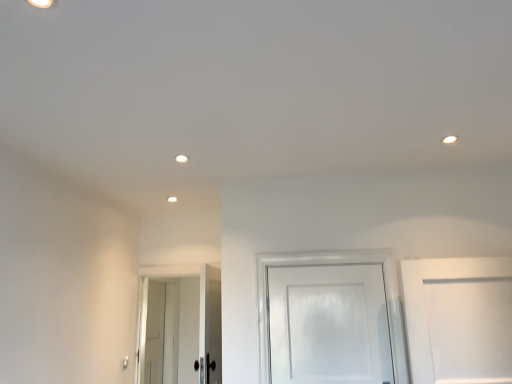
Question: Is white glossy door at lower left, the 2th door in the front-to-back sequence, at the right side of white glossy door at lower left, the 1th door when ordered from left to right?

Choices:
 (A) yes
 (B) no

Answer: (A)

Question: From the image's perspective, is white glossy door at lower left, the second door from the back, beneath white glossy door at lower left, which ranks as the third door in right-to-left order?

Choices:
 (A) yes
 (B) no

Answer: (B)

Question: Can you confirm if white glossy door at lower left, the second door from the back, is smaller than white glossy door at lower left, the 1th door when ordered from left to right?

Choices:
 (A) no
 (B) yes

Answer: (A)

Question: From a real-world perspective, is white glossy door at lower left, arranged as the second door when viewed from the right, physically above white glossy door at lower left, which ranks as the third door in right-to-left order?

Choices:
 (A) no
 (B) yes

Answer: (B)

Question: Can you confirm if white glossy door at lower left, the 2th door in the front-to-back sequence, is bigger than white glossy door at lower left, marked as the first door in a back-to-front arrangement?

Choices:
 (A) yes
 (B) no

Answer: (A)

Question: From the image's perspective, is white glossy door at center, the 3th door positioned from the left, positioned above or below white glossy door at lower left, the second door from the back?

Choices:
 (A) above
 (B) below

Answer: (A)

Question: Is white glossy door at center, which appears as the 1th door when viewed from the front, to the left or to the right of white glossy door at lower left, the second door from the back, in the image?

Choices:
 (A) right
 (B) left

Answer: (A)

Question: Is point (270, 334) positioned closer to the camera than point (160, 324)?

Choices:
 (A) farther
 (B) closer

Answer: (B)

Question: From their relative heights in the image, would you say white glossy door at center, the 3th door positioned from the left, is taller or shorter than white glossy door at lower left, the second door from the back?

Choices:
 (A) tall
 (B) short

Answer: (B)

Question: Considering the positions of point (161, 372) and point (376, 278), is point (161, 372) closer or farther from the camera than point (376, 278)?

Choices:
 (A) farther
 (B) closer

Answer: (A)

Question: Considering the positions of white glossy door at lower left, the 1th door when ordered from left to right, and white glossy door at center, arranged as the 3th door when viewed from the back, in the image, is white glossy door at lower left, the 1th door when ordered from left to right, wider or thinner than white glossy door at center, arranged as the 3th door when viewed from the back,?

Choices:
 (A) thin
 (B) wide

Answer: (B)

Question: In terms of height, does white glossy door at lower left, marked as the first door in a back-to-front arrangement, look taller or shorter compared to white glossy door at center, arranged as the 3th door when viewed from the back?

Choices:
 (A) short
 (B) tall

Answer: (B)

Question: From a real-world perspective, is white glossy door at lower left, marked as the first door in a back-to-front arrangement, positioned above or below white glossy door at center, the 3th door positioned from the left?

Choices:
 (A) below
 (B) above

Answer: (A)

Question: In terms of width, does white glossy door at lower left, the 2th door in the front-to-back sequence, look wider or thinner when compared to white glossy door at center, arranged as the 3th door when viewed from the back?

Choices:
 (A) thin
 (B) wide

Answer: (B)

Question: Relative to white glossy door at center, arranged as the 3th door when viewed from the back, is white glossy door at lower left, arranged as the second door when viewed from the right, in front or behind?

Choices:
 (A) front
 (B) behind

Answer: (B)